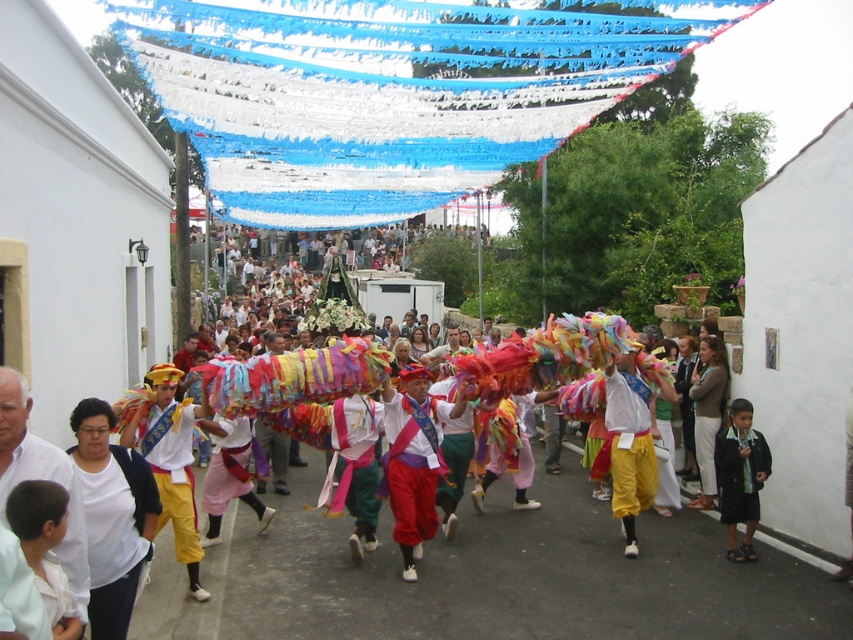
Consider the image. Does white cotton shirt at lower left appear on the right side of dark blue fabric at lower right?

In fact, white cotton shirt at lower left is to the left of dark blue fabric at lower right.

Does white cotton shirt at lower left have a smaller size compared to dark blue fabric at lower right?

Actually, white cotton shirt at lower left might be larger than dark blue fabric at lower right.

Who is more distant from viewer, (x=138, y=477) or (x=730, y=470)?

Point (x=730, y=470)

At what (x,y) coordinates should I click in order to perform the action: click on white cotton shirt at lower left. Please return your answer as a coordinate pair (x, y). The height and width of the screenshot is (640, 853). Looking at the image, I should click on (112, 516).

Between multicolored fabric at center and dark blue fabric at lower right, which one has more height?

multicolored fabric at center is taller.

Between multicolored fabric at center and dark blue fabric at lower right, which one has less height?

dark blue fabric at lower right

Which is behind, point (300, 548) or point (734, 413)?

The point (300, 548) is behind.

Image resolution: width=853 pixels, height=640 pixels. In order to click on multicolored fabric at center in this screenshot , I will do `click(396, 570)`.

Which is in front, point (387, 563) or point (148, 472)?

Point (148, 472) is in front.

Looking at this image, does multicolored fabric at center appear under white cotton shirt at lower left?

Yes, multicolored fabric at center is below white cotton shirt at lower left.

Describe the element at coordinates (396, 570) in the screenshot. Image resolution: width=853 pixels, height=640 pixels. I see `multicolored fabric at center` at that location.

Find the location of a particular element. This screenshot has height=640, width=853. multicolored fabric at center is located at coordinates (396, 570).